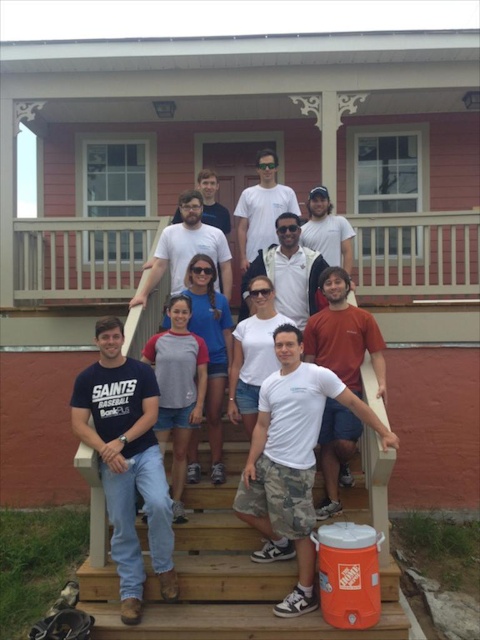
Question: Which of the following is the closest to the observer?

Choices:
 (A) dark blue t-shirt at center
 (B) wooden stairs at lower center
 (C) white matte sunglasses at center

Answer: (B)

Question: Which point appears closest to the camera in this image?

Choices:
 (A) (126, 292)
 (B) (336, 420)
 (C) (189, 365)

Answer: (B)

Question: Is gray/red t-shirt at center smaller than white matte sunglasses at center?

Choices:
 (A) no
 (B) yes

Answer: (B)

Question: Based on their relative distances, which object is farther from the gray/red t-shirt at center?

Choices:
 (A) white matte sunglasses at center
 (B) wooden stairs at lower center
 (C) dark blue t-shirt at center
 (D) white wooden railing at upper center

Answer: (D)

Question: Does dark blue t-shirt at center appear over orange cotton t-shirt at center?

Choices:
 (A) yes
 (B) no

Answer: (B)

Question: Is dark blue t-shirt at center below orange cotton t-shirt at center?

Choices:
 (A) yes
 (B) no

Answer: (A)